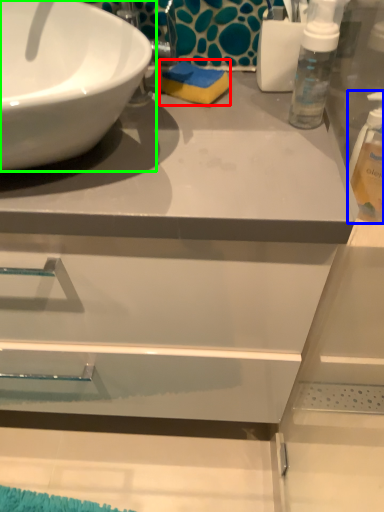
Question: Estimate the real-world distances between objects in this image. Which object is closer to soap (highlighted by a red box), cleaning product (highlighted by a blue box) or sink (highlighted by a green box)?

Choices:
 (A) cleaning product
 (B) sink

Answer: (B)